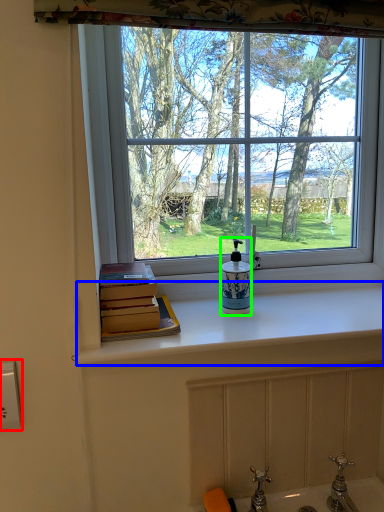
Question: Estimate the real-world distances between objects in this image. Which object is closer to electric outlet (highlighted by a red box), counter top (highlighted by a blue box) or soap dispenser (highlighted by a green box)?

Choices:
 (A) counter top
 (B) soap dispenser

Answer: (B)